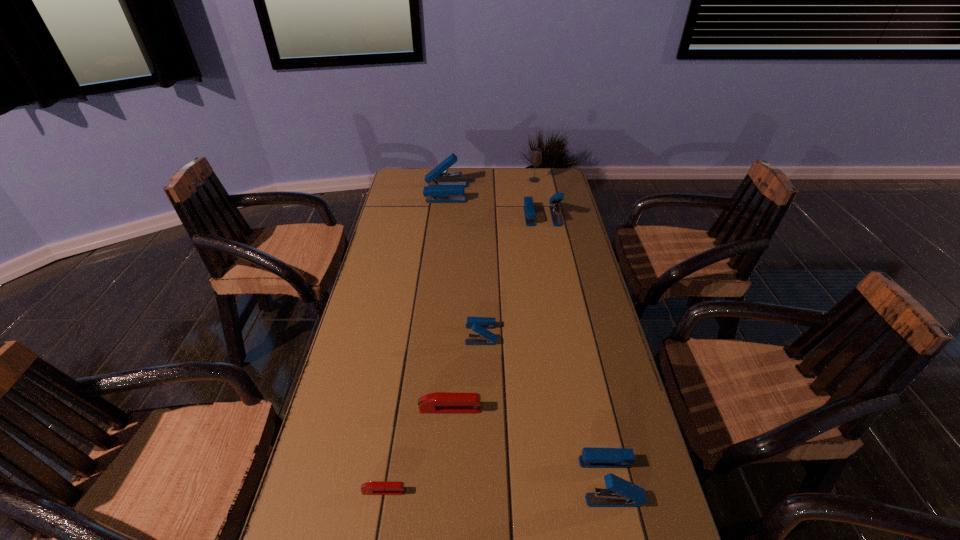
Locate an element on the screen. The width and height of the screenshot is (960, 540). the sixth tallest object is located at coordinates (439, 402).

This screenshot has width=960, height=540. I want to click on the shortest object, so click(375, 487).

At what (x,y) coordinates should I click in order to perform the action: click on the nearer red stapler. Please return your answer as a coordinate pair (x, y). Looking at the image, I should click on (375, 487).

The height and width of the screenshot is (540, 960). In order to click on vacant space situated 0.080m on the right of the farthest object in this screenshot , I will do `click(558, 180)`.

I want to click on free region located on the front of the biggest blue stapler, so click(443, 215).

Where is `vacant space located 0.100m on the front of the third farthest object`? Image resolution: width=960 pixels, height=540 pixels. vacant space located 0.100m on the front of the third farthest object is located at coordinates (547, 242).

At what (x,y) coordinates should I click in order to perform the action: click on vacant space situated 0.250m on the left of the third biggest blue stapler. Please return your answer as a coordinate pair (x, y). This screenshot has height=540, width=960. Looking at the image, I should click on (466, 481).

I want to click on free space located 0.220m on the left of the fourth farthest object, so click(389, 334).

Locate an element on the screen. This screenshot has height=540, width=960. vacant region located 0.200m on the front-facing side of the third nearest stapler is located at coordinates (563, 409).

Where is `vacant space situated on the front-facing side of the left red stapler`? This screenshot has width=960, height=540. vacant space situated on the front-facing side of the left red stapler is located at coordinates (443, 491).